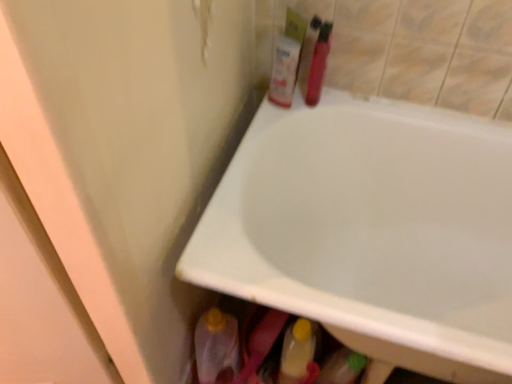
This screenshot has height=384, width=512. I want to click on free space in front of translucent plastic bottle at upper center, which is the 2th toiletry from right to left, so click(x=267, y=125).